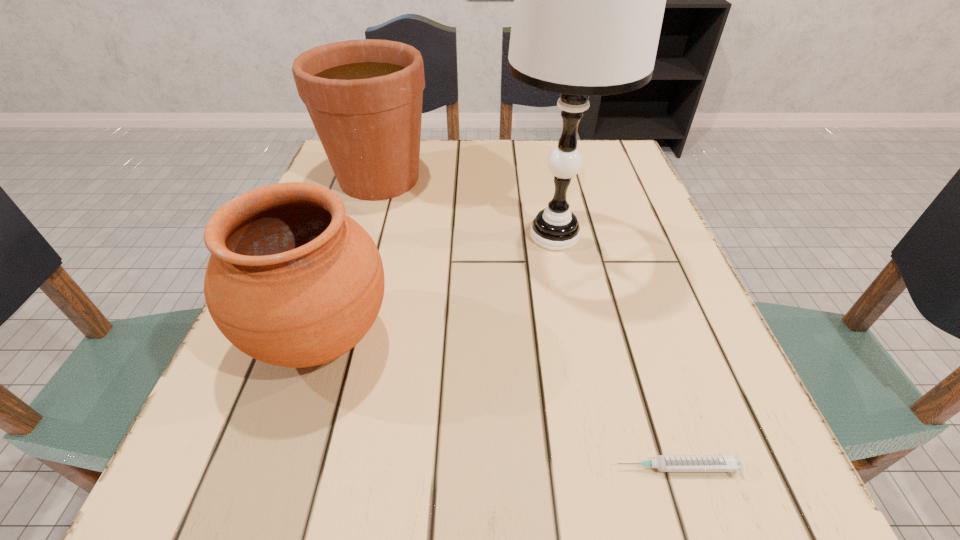
Where is `table lamp`? table lamp is located at coordinates (589, 0).

The image size is (960, 540). Identify the location of flowerpot. pyautogui.click(x=364, y=97).

Where is `the second nearest object`? the second nearest object is located at coordinates (292, 281).

Locate an element on the screen. the shortest object is located at coordinates (732, 463).

Find the location of a particular element. The width and height of the screenshot is (960, 540). syringe is located at coordinates (732, 463).

Image resolution: width=960 pixels, height=540 pixels. I want to click on free space located 0.300m on the left of the tallest object, so click(x=355, y=235).

This screenshot has width=960, height=540. I want to click on vacant region located 0.160m on the front of the flowerpot, so click(355, 258).

Find the location of a particular element. The width and height of the screenshot is (960, 540). vacant space positioned 0.070m on the front of the second nearest object is located at coordinates (285, 451).

You are a GUI agent. You are given a task and a screenshot of the screen. Output one action in this format:
    pyautogui.click(x=<x>, y=<y>)
    Task: Click on the blank space located 0.240m at the needle end of the syringe
    Image resolution: width=960 pixels, height=540 pixels.
    Given the screenshot: What is the action you would take?
    (429, 468)

The image size is (960, 540). What are the coordinates of `vacant point located 0.180m at the needle end of the syringe` in the screenshot? It's located at (475, 468).